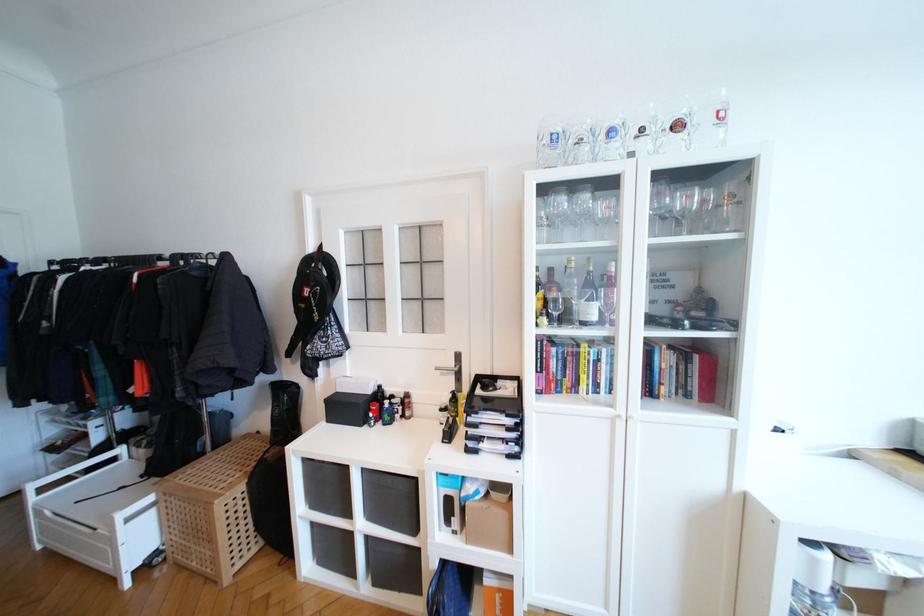
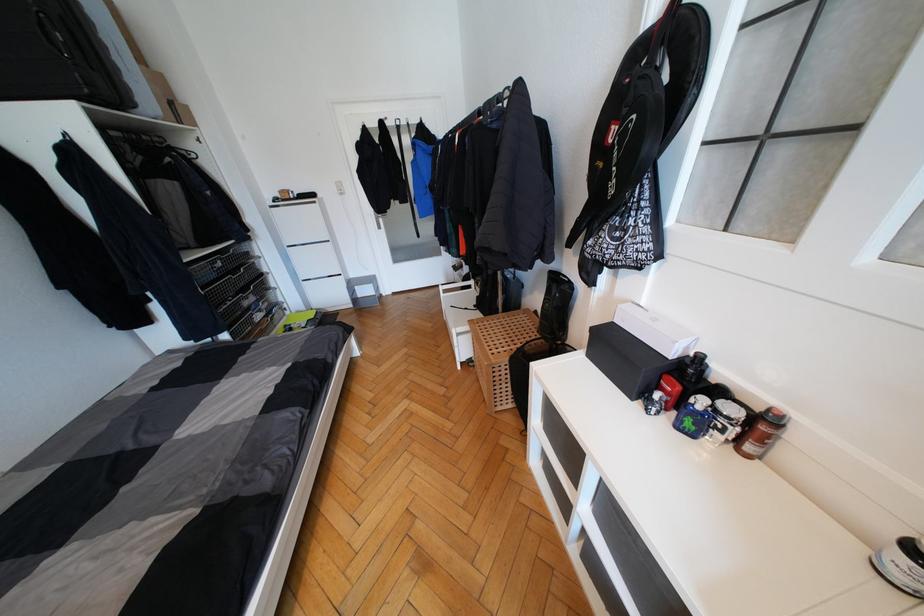
The point at the highlighted location is marked in the first image. Where is the corresponding point in the second image?

(663, 389)